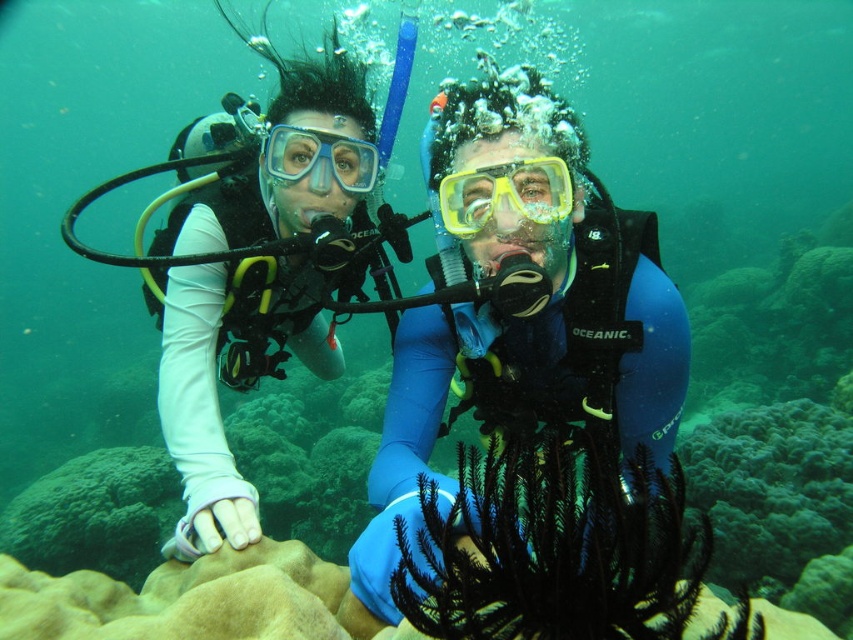
Question: Which object appears closest to the camera in this image?

Choices:
 (A) blue rubber suit at center
 (B) yellow matte goggles at center

Answer: (A)

Question: Does white matte diving suit at upper left appear on the right side of yellow matte goggles at center?

Choices:
 (A) no
 (B) yes

Answer: (A)

Question: Which of the following is the farthest from the observer?

Choices:
 (A) (520, 188)
 (B) (375, 177)
 (C) (216, 193)

Answer: (C)

Question: Does yellow matte goggles at center appear under clear plastic goggles at upper center?

Choices:
 (A) no
 (B) yes

Answer: (B)

Question: Which object appears farthest from the camera in this image?

Choices:
 (A) clear plastic goggles at upper center
 (B) blue rubber suit at center
 (C) white matte diving suit at upper left
 (D) yellow matte goggles at center

Answer: (A)

Question: Can you confirm if yellow matte goggles at center is positioned to the left of clear plastic goggles at upper center?

Choices:
 (A) yes
 (B) no

Answer: (B)